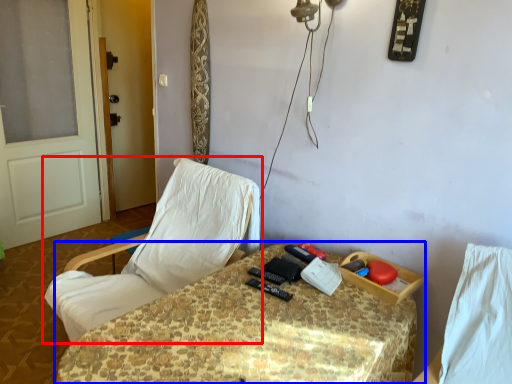
Question: Which of the following is the farthest to the observer, chair (highlighted by a red box) or table (highlighted by a blue box)?

Choices:
 (A) chair
 (B) table

Answer: (A)